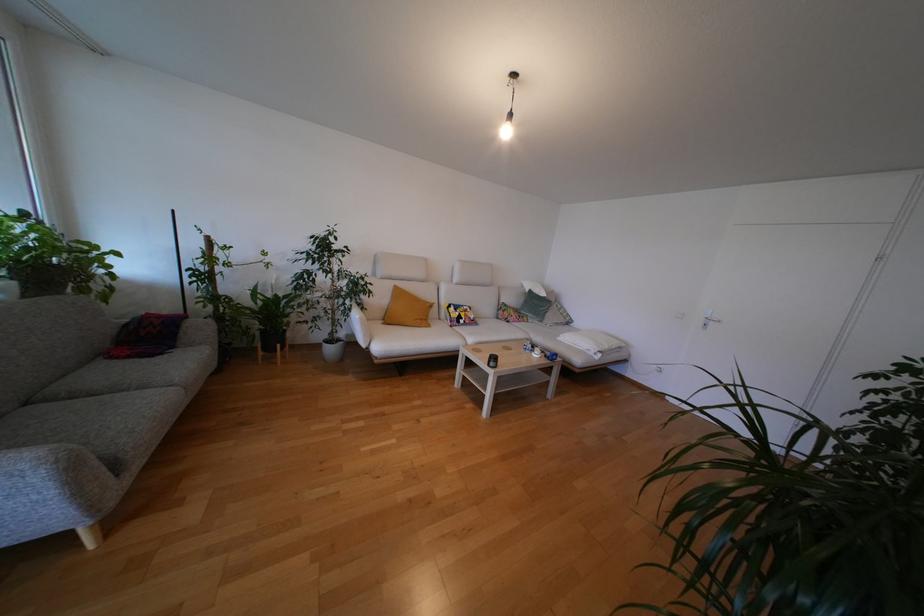
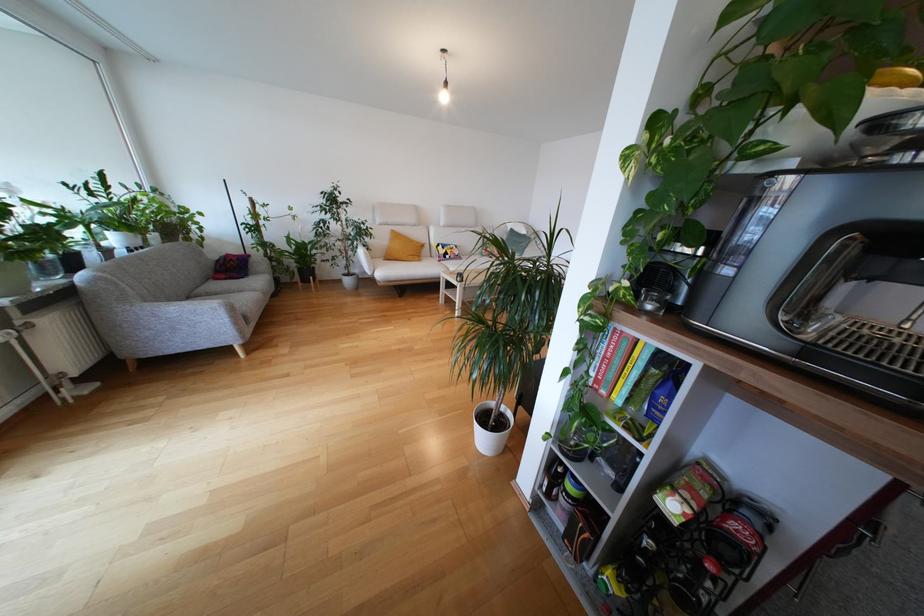
In the second image, find the point that corresponds to (x=186, y=334) in the first image.

(253, 268)